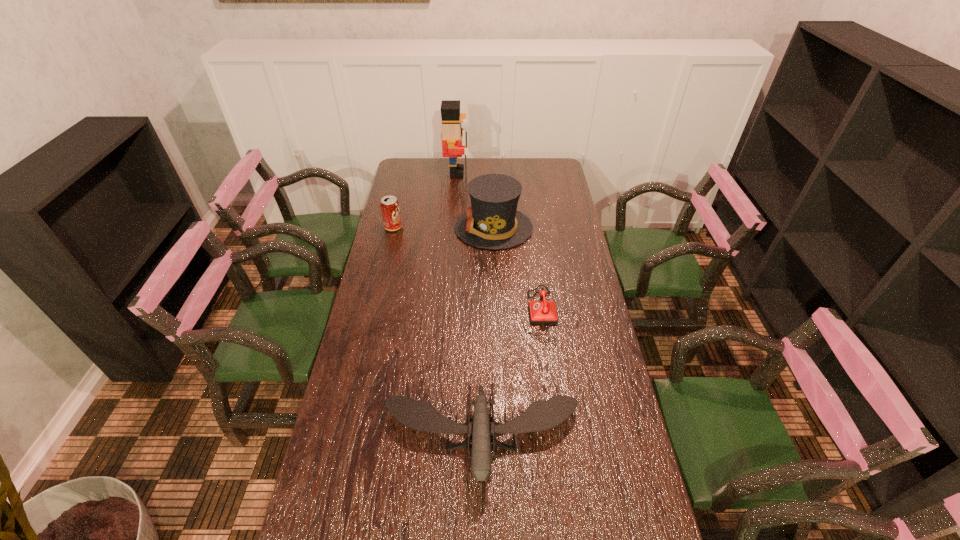
Where is `free point between the dress hat and the fourth farthest object`? The height and width of the screenshot is (540, 960). free point between the dress hat and the fourth farthest object is located at coordinates pyautogui.click(x=523, y=271).

You are a GUI agent. You are given a task and a screenshot of the screen. Output one action in this format:
    pyautogui.click(x=<x>, y=<y>)
    Task: Click on the object that is the fourth closest to the third tallest object
    The width and height of the screenshot is (960, 540).
    Given the screenshot: What is the action you would take?
    pyautogui.click(x=541, y=415)

You are a GUI agent. You are given a task and a screenshot of the screen. Output one action in this format:
    pyautogui.click(x=<x>, y=<y>)
    Task: Click on the closest object to the farthest object
    
    Given the screenshot: What is the action you would take?
    pyautogui.click(x=492, y=222)

Where is `free spot that satisfies the following two spatial constraints: 1. on the dial of the fourth farthest object; 2. at the head of the fourth tallest object`? Image resolution: width=960 pixels, height=540 pixels. free spot that satisfies the following two spatial constraints: 1. on the dial of the fourth farthest object; 2. at the head of the fourth tallest object is located at coordinates (572, 437).

The width and height of the screenshot is (960, 540). I want to click on free point that satisfies the following two spatial constraints: 1. with goggles on the front of the fourth shortest object; 2. at the head of the nearest object, so click(501, 437).